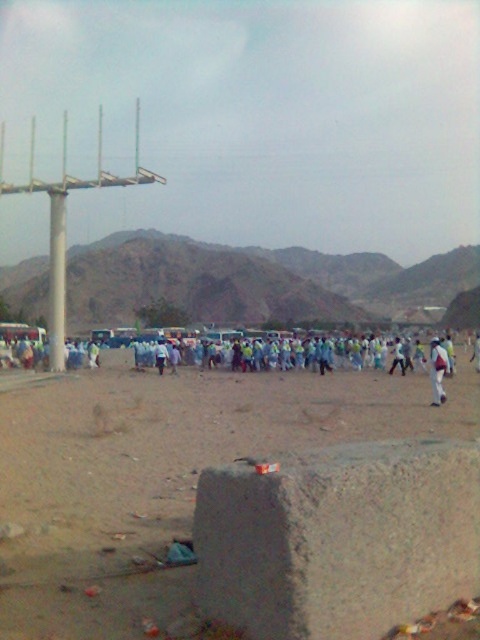
You are standing at the point marked as point (164, 476) in the image. What type of ground material are you currently standing on?

You are standing on brown sandy dirt at center located at point (164, 476).

You are standing at the concrete barrier in the foreground of the desert scene. You see two points marked in the image. Which point, point (124, 544) or point (432, 352), is closer to you?

Point (124, 544) is closer to the viewer than point (432, 352).